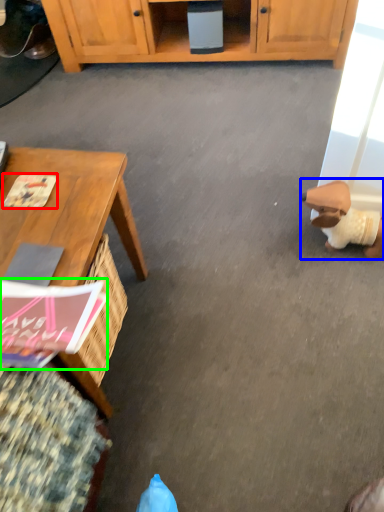
Question: Considering the real-world distances, which object is closest to magazine (highlighted by a red box)? toy (highlighted by a blue box) or magazine (highlighted by a green box).

Choices:
 (A) toy
 (B) magazine

Answer: (B)